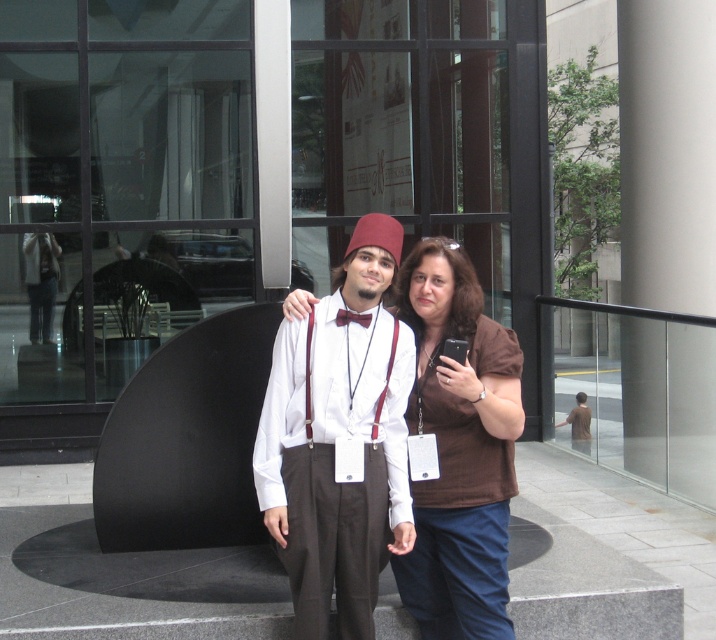
Can you confirm if white matte shirt at center is positioned below brown fabric shirt at center?

Actually, white matte shirt at center is above brown fabric shirt at center.

Which is more to the left, white matte shirt at center or brown fabric shirt at center?

Positioned to the left is white matte shirt at center.

Locate an element on the screen. white matte shirt at center is located at coordinates (339, 440).